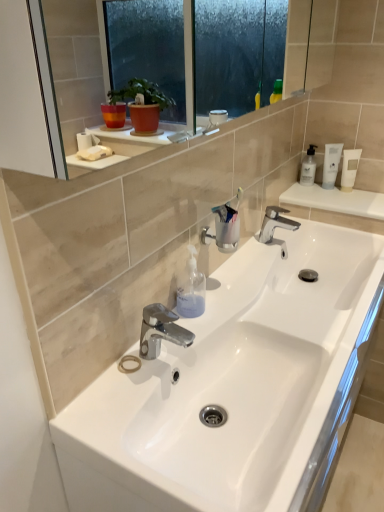
You are a GUI agent. You are given a task and a screenshot of the screen. Output one action in this format:
    pyautogui.click(x=<x>, y=<y>)
    Task: Click on the spots to the right of transparent plastic soap dispenser at center, the first toiletry positioned from the front
    
    Given the screenshot: What is the action you would take?
    pyautogui.click(x=235, y=306)